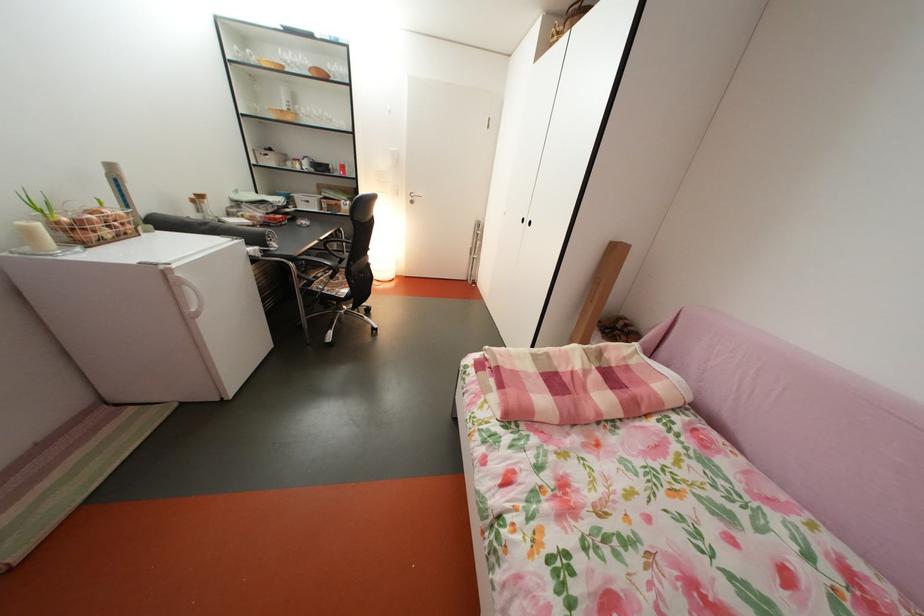
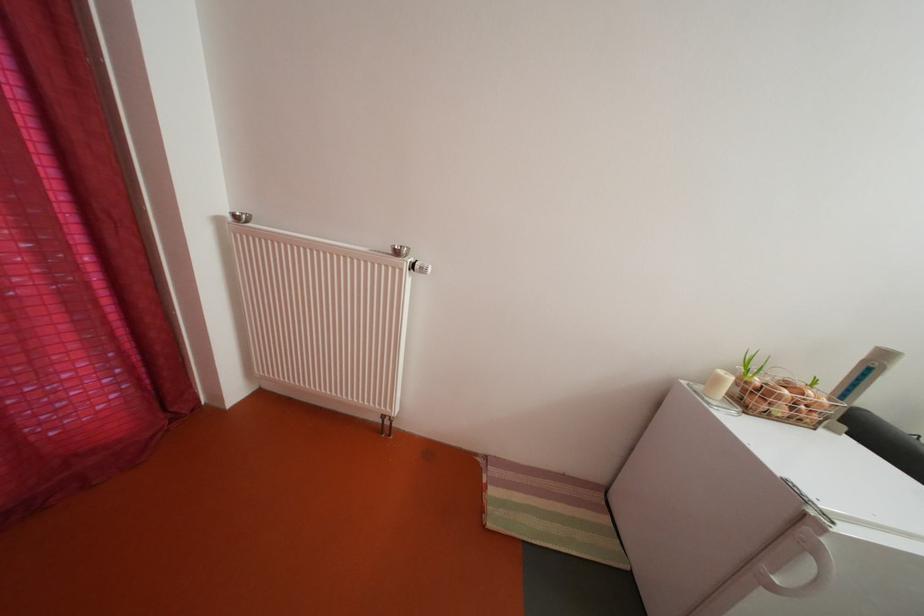
Where in the second image is the point corresponding to [208,321] from the first image?

(784, 594)